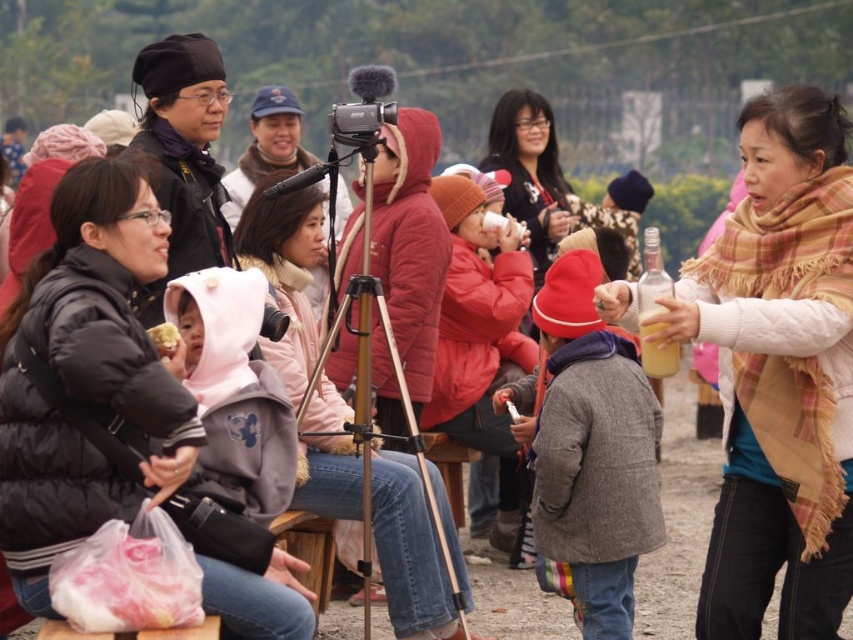
In the scene shown: How far apart are black puffy jacket at left and black matte tripod at center?

A distance of 8.02 meters exists between black puffy jacket at left and black matte tripod at center.

Can you confirm if black puffy jacket at left is positioned to the left of black matte tripod at center?

Yes, black puffy jacket at left is to the left of black matte tripod at center.

Does point (264, 616) lie behind point (358, 316)?

No, it is in front of (358, 316).

Image resolution: width=853 pixels, height=640 pixels. What are the coordinates of `black puffy jacket at left` in the screenshot? It's located at (86, 378).

Looking at this image, is plaid scarf at center below black matte tripod at center?

Yes, plaid scarf at center is below black matte tripod at center.

Does plaid scarf at center appear on the left side of black matte tripod at center?

Incorrect, plaid scarf at center is not on the left side of black matte tripod at center.

This screenshot has height=640, width=853. Identify the location of plaid scarf at center. (779, 372).

Does plaid scarf at center have a larger size compared to yellow matte cake at center?

Yes.

Can you confirm if plaid scarf at center is positioned above yellow matte cake at center?

No, plaid scarf at center is not above yellow matte cake at center.

Who is more distant from viewer, (830, 579) or (163, 348)?

The point (830, 579) is behind.

Identify the location of plaid scarf at center. This screenshot has height=640, width=853. (779, 372).